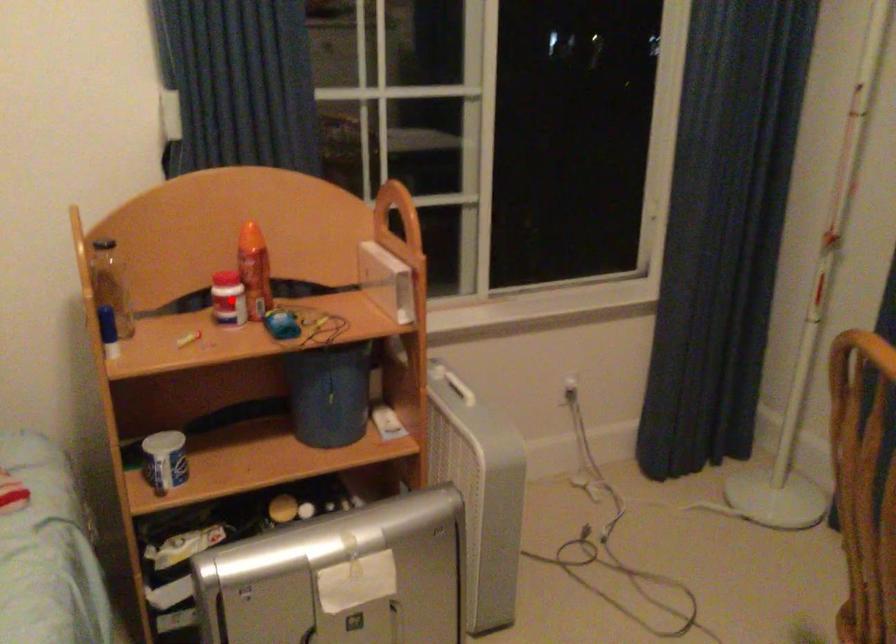
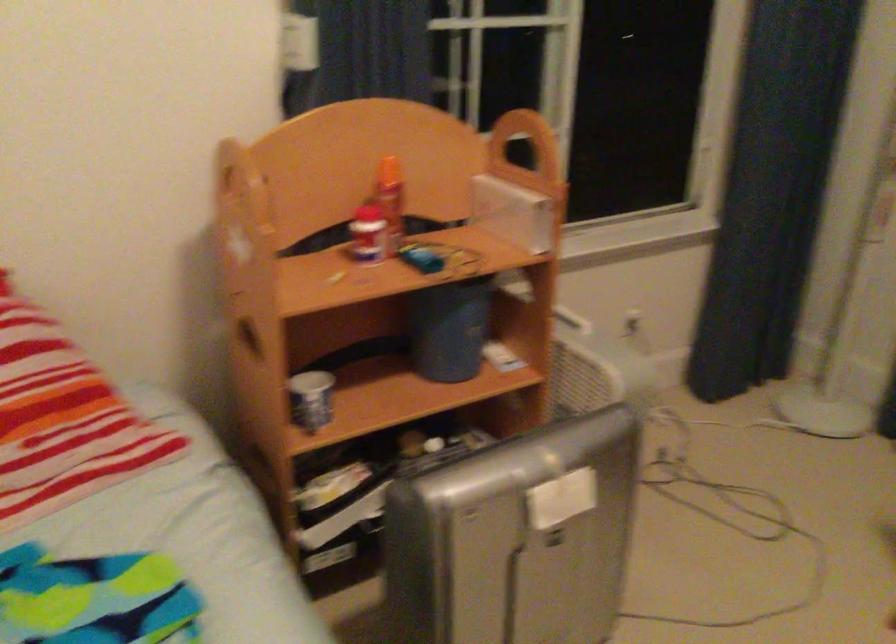
The point at the highlighted location is marked in the first image. Where is the corresponding point in the second image?

(367, 234)